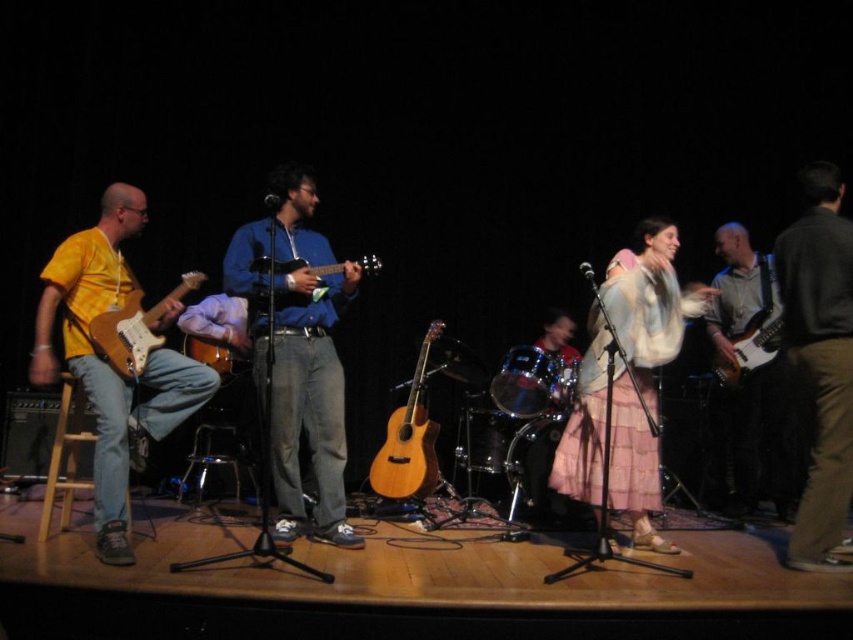
You are a stagehand who needs to place a 2.5 meter long ladder between the blue denim jeans at center and the electric guitar. Can you safely place the ladder without it overlapping either object?

The blue denim jeans at center and the electric guitar are 3.57 meters apart. Since the ladder is 2.5 meters long, it can be placed between them without overlapping either object as there is enough space. However, the exact placement would depend on the positioning of the musicians and their movements during the performance.

You are a photographer positioned at the center of the stage. You want to take a photo of the dark gray sweater at right. Which direction should you move to get a better shot?

The dark gray sweater at right is located at point 0.567 on the x axis and 0.962 on the y axis. Since you are at the center of the stage, you should move to the right and slightly forward to align with the sweater.

You are standing in the audience and want to take a photo of the point at coordinates point (825,449). The camera you are using has a focal length of 50mm and an aperture of f2.8. To ensure the point is in focus, what is the minimum distance you need to be from the point?

The point at coordinates point (825,449) is 11.64 feet away from the camera. Therefore, the minimum distance required to ensure the point is in focus is 11.64 feet.